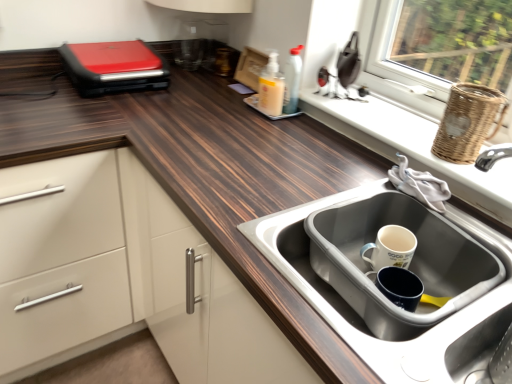
The width and height of the screenshot is (512, 384). In order to click on stainless steel sink at lower right in this screenshot , I will do `click(366, 318)`.

Describe the element at coordinates (413, 148) in the screenshot. The image size is (512, 384). I see `white wicker basket at right` at that location.

Where is `white wicker basket at right`? white wicker basket at right is located at coordinates (413, 148).

Measure the distance between point (373, 260) and camera.

Point (373, 260) is 96.00 centimeters from camera.

The width and height of the screenshot is (512, 384). Describe the element at coordinates (390, 248) in the screenshot. I see `white matte mug at sink` at that location.

Where is `red matte sandwich maker at upper left`? This screenshot has width=512, height=384. red matte sandwich maker at upper left is located at coordinates (113, 67).

In the scene shown: Which is less distant, (163, 88) or (261, 80)?

Clearly, point (163, 88) is closer to the camera than point (261, 80).

In the scene shown: Is red matte sandwich maker at upper left beside translucent plastic soap dispenser at center?

red matte sandwich maker at upper left is not next to translucent plastic soap dispenser at center, and they're not touching.

From the image's perspective, is red matte sandwich maker at upper left on translucent plastic soap dispenser at center?

Yes, from the image's perspective, red matte sandwich maker at upper left is over translucent plastic soap dispenser at center.

Where is `bottle that is above the red matte sandwich maker at upper left (from a real-world perspective)`? Image resolution: width=512 pixels, height=384 pixels. bottle that is above the red matte sandwich maker at upper left (from a real-world perspective) is located at coordinates (271, 88).

From the image's perspective, is stainless steel sink at lower right located beneath white matte mug at sink?

Yes, from the image's perspective, stainless steel sink at lower right is beneath white matte mug at sink.

Considering the relative sizes of stainless steel sink at lower right and white matte mug at sink in the image provided, is stainless steel sink at lower right taller than white matte mug at sink?

Yes, stainless steel sink at lower right is taller than white matte mug at sink.

In terms of width, does stainless steel sink at lower right look wider or thinner when compared to white matte mug at sink?

In the image, stainless steel sink at lower right appears to be wider than white matte mug at sink.

Which of these two, stainless steel sink at lower right or white matte mug at sink, is smaller?

With smaller size is white matte mug at sink.

From the image's perspective, which is below, white wicker basket at right or white matte mug at sink?

white matte mug at sink.

Between white wicker basket at right and white matte mug at sink, which one has larger width?

white wicker basket at right is wider.

From a real-world perspective, is white wicker basket at right positioned under white matte mug at sink based on gravity?

No, from a real-world perspective, white wicker basket at right is not beneath white matte mug at sink.

Does red matte sandwich maker at upper left come in front of stainless steel sink at lower right?

No, the depth of red matte sandwich maker at upper left is greater than that of stainless steel sink at lower right.

How different are the orientations of red matte sandwich maker at upper left and stainless steel sink at lower right in degrees?

91 degrees separate the facing orientations of red matte sandwich maker at upper left and stainless steel sink at lower right.

Is red matte sandwich maker at upper left bigger than stainless steel sink at lower right?

No.

Is wooden countertop at upper left not close to white wicker basket at right?

No, wooden countertop at upper left is not far away from white wicker basket at right.

Is wooden countertop at upper left wider than white wicker basket at right?

Yes, wooden countertop at upper left is wider than white wicker basket at right.

Can you confirm if wooden countertop at upper left is positioned to the left of white wicker basket at right?

Yes, wooden countertop at upper left is to the left of white wicker basket at right.

Between point (113, 280) and point (368, 104), which one is positioned in front?

Positioned in front is point (368, 104).

Is stainless steel sink at lower right oriented away from white wicker basket at right?

stainless steel sink at lower right is not turned away from white wicker basket at right.

From the image's perspective, is stainless steel sink at lower right located beneath white wicker basket at right?

Yes.

Does stainless steel sink at lower right have a lesser width compared to white wicker basket at right?

In fact, stainless steel sink at lower right might be wider than white wicker basket at right.

Considering the positions of objects stainless steel sink at lower right and woven brown basket at upper right in the image provided, who is in front, stainless steel sink at lower right or woven brown basket at upper right?

Positioned in front is stainless steel sink at lower right.

Who is taller, stainless steel sink at lower right or woven brown basket at upper right?

woven brown basket at upper right is taller.

From the image's perspective, between stainless steel sink at lower right and woven brown basket at upper right, who is located below?

stainless steel sink at lower right is shown below in the image.

Identify the location of appliance behind the translucent plastic soap dispenser at center. (113, 67).

In the image, there is a white matte mug at sink. What are the coordinates of `sink below it (from the image's perspective)` in the screenshot? It's located at (366, 318).

Estimate the real-world distances between objects in this image. Which object is further from stainless steel sink at lower right, red matte sandwich maker at upper left or wooden countertop at upper left?

red matte sandwich maker at upper left is positioned further to the anchor stainless steel sink at lower right.

Based on their spatial positions, is white wicker basket at right or woven brown basket at upper right further from wooden countertop at upper left?

woven brown basket at upper right is further to wooden countertop at upper left.

Based on their spatial positions, is white matte mug at sink or stainless steel sink at lower right further from red matte sandwich maker at upper left?

Based on the image, white matte mug at sink appears to be further to red matte sandwich maker at upper left.

Looking at the image, which one is located closer to red matte sandwich maker at upper left, woven brown basket at upper right or wooden countertop at upper left?

Based on the image, wooden countertop at upper left appears to be nearer to red matte sandwich maker at upper left.

When comparing their distances from translucent plastic soap dispenser at center, does red matte sandwich maker at upper left or white matte mug at sink seem further?

The object further to translucent plastic soap dispenser at center is white matte mug at sink.

When comparing their distances from white matte mug at sink, does woven brown basket at upper right or translucent plastic soap dispenser at center seem closer?

woven brown basket at upper right lies closer to white matte mug at sink than the other object.

Which object lies further to the anchor point stainless steel sink at lower right, white wicker basket at right or red matte sandwich maker at upper left?

red matte sandwich maker at upper left is positioned further to the anchor stainless steel sink at lower right.

Considering their positions, is woven brown basket at upper right positioned closer to white wicker basket at right than red matte sandwich maker at upper left?

Among the two, woven brown basket at upper right is located nearer to white wicker basket at right.

What are the coordinates of `coffee located between red matte sandwich maker at upper left and white wicker basket at right in the left-right direction` in the screenshot? It's located at (390, 248).

This screenshot has height=384, width=512. In order to click on sink between red matte sandwich maker at upper left and white wicker basket at right in the horizontal direction in this screenshot , I will do `click(366, 318)`.

What are the coordinates of `sink between red matte sandwich maker at upper left and white matte mug at sink` in the screenshot? It's located at (366, 318).

I want to click on appliance situated between wooden countertop at upper left and stainless steel sink at lower right from left to right, so click(113, 67).